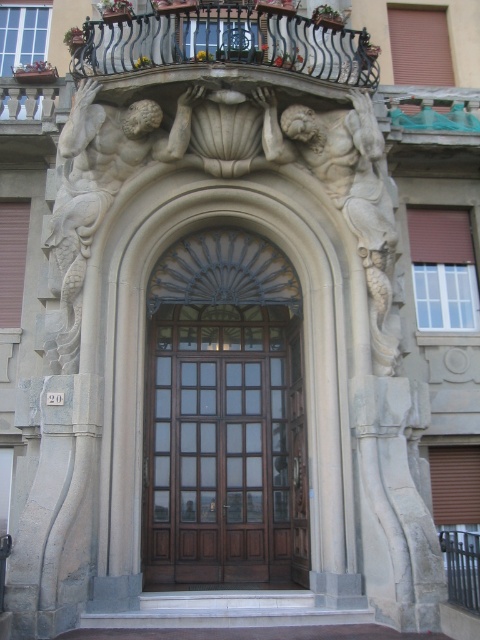
Question: Is carved stone figures at center positioned behind polished metal balustrade at center?

Choices:
 (A) yes
 (B) no

Answer: (A)

Question: Does carved stone figures at center appear on the left side of polished metal balustrade at center?

Choices:
 (A) yes
 (B) no

Answer: (A)

Question: Which object is the closest to the mahogany wood door at center?

Choices:
 (A) black wrought iron balcony at upper center
 (B) polished metal balustrade at center

Answer: (B)

Question: Does carved stone figures at center have a larger size compared to black wrought iron balcony at upper center?

Choices:
 (A) yes
 (B) no

Answer: (A)

Question: Estimate the real-world distances between objects in this image. Which object is farther from the carved stone figures at center?

Choices:
 (A) polished metal balustrade at center
 (B) black wrought iron balcony at upper center
 (C) mahogany wood door at center

Answer: (A)

Question: Which object appears closest to the camera in this image?

Choices:
 (A) black wrought iron balcony at upper center
 (B) polished metal balustrade at center

Answer: (B)